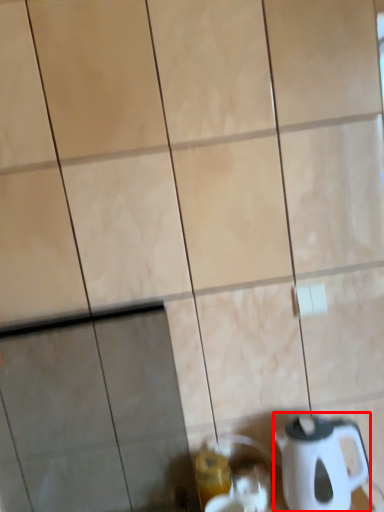
Question: Where is kettle (annotated by the red box) located in relation to beverage in the image?

Choices:
 (A) right
 (B) left

Answer: (A)